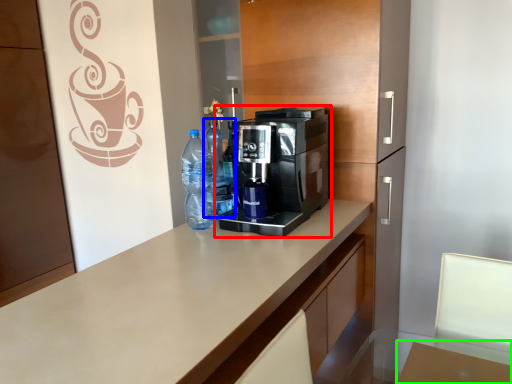
Question: Which object is positioned closest to coffee maker (highlighted by a red box)? Select from bottle (highlighted by a blue box) and table (highlighted by a green box).

Choices:
 (A) bottle
 (B) table

Answer: (A)